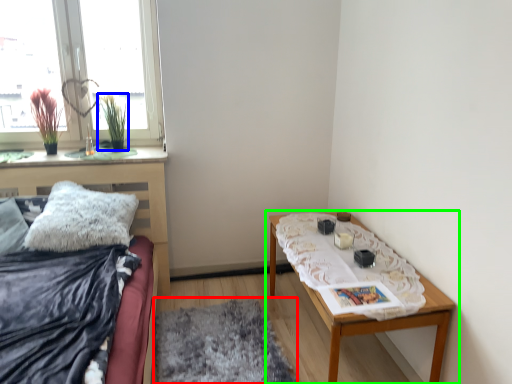
Question: Based on their relative distances, which object is farther from mat (highlighted by a red box)? Choose from plant (highlighted by a blue box) and table (highlighted by a green box).

Choices:
 (A) plant
 (B) table

Answer: (A)